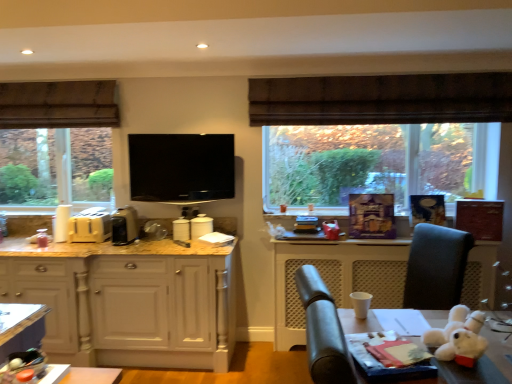
Where is `space that is in front of matte yellow toaster at left, the fourth appliance viewed from the right`? Image resolution: width=512 pixels, height=384 pixels. space that is in front of matte yellow toaster at left, the fourth appliance viewed from the right is located at coordinates (82, 246).